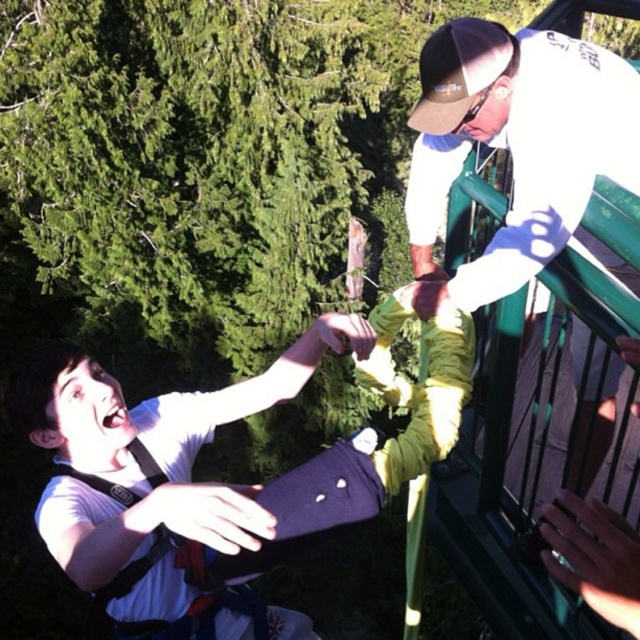
Question: Which point is closer to the camera?

Choices:
 (A) white matte shirt at center
 (B) white matte baseball cap at upper right

Answer: (A)

Question: From the image, what is the correct spatial relationship of white matte shirt at center in relation to white matte baseball cap at upper right?

Choices:
 (A) above
 (B) below

Answer: (B)

Question: Is white matte shirt at center positioned before white matte baseball cap at upper right?

Choices:
 (A) no
 (B) yes

Answer: (B)

Question: From the image, what is the correct spatial relationship of white matte shirt at center in relation to white matte baseball cap at upper right?

Choices:
 (A) right
 (B) left

Answer: (B)